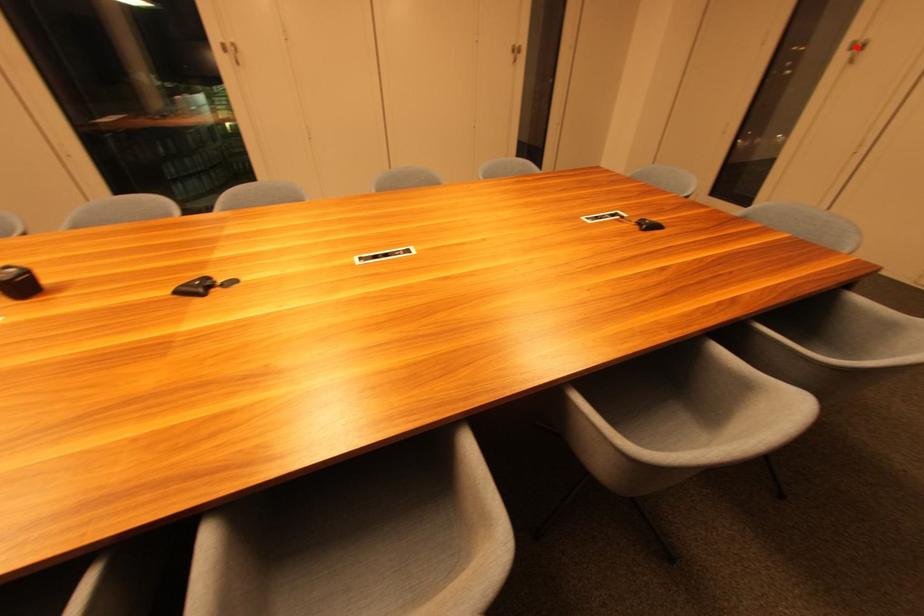
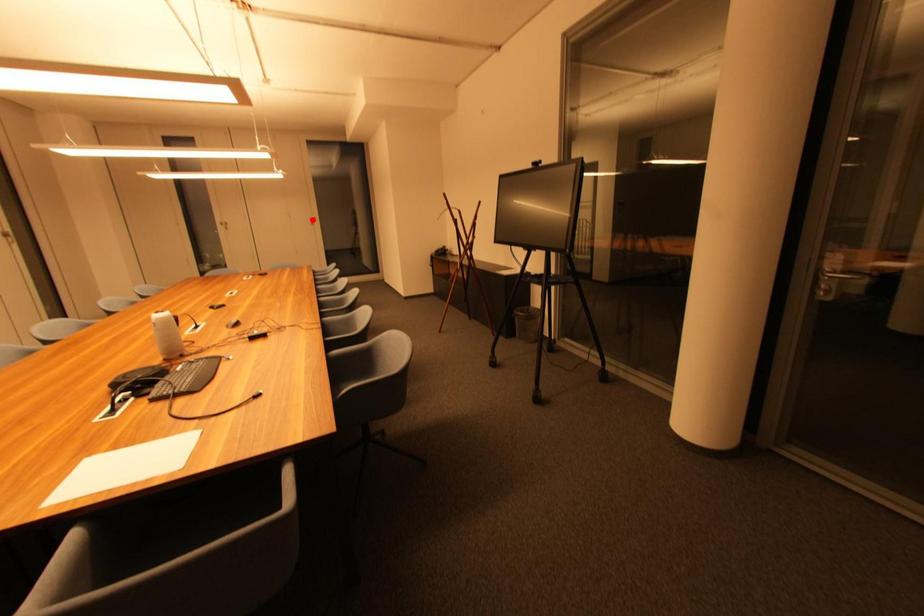
I am providing you with two images of the same scene from different viewpoints. A red point is marked on the first image and another point is marked on the second image. Do the highlighted points in image1 and image2 indicate the same real-world spot?

No